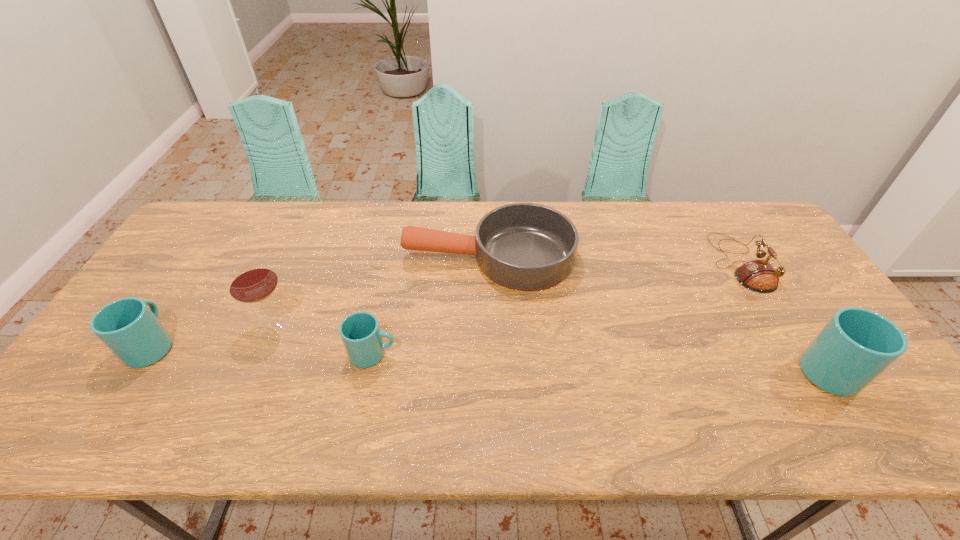
At what (x,y) coordinates should I click in order to perform the action: click on spot to insert another cup for uniform distribution. Please return your answer as a coordinate pair (x, y). The width and height of the screenshot is (960, 540). Looking at the image, I should click on (601, 363).